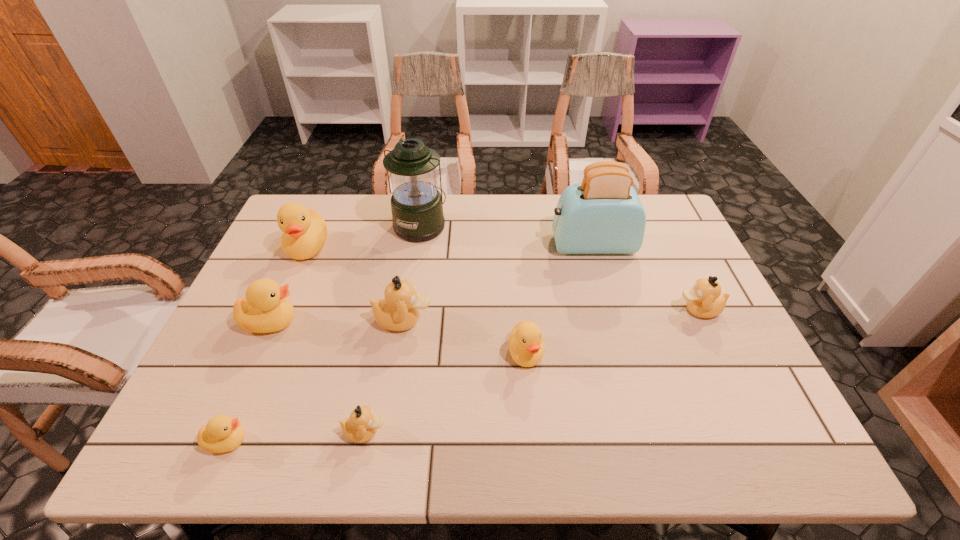
In order to click on lantern in this screenshot , I will do `click(416, 204)`.

I want to click on the eighth object from left to right, so click(602, 215).

The image size is (960, 540). In order to click on toaster in this screenshot , I will do `click(602, 215)`.

Locate an element on the screen. the farthest yellow duckling is located at coordinates (304, 230).

I want to click on the farthest duckling, so click(x=304, y=230).

The image size is (960, 540). Find the location of `the biggest tan duckling`. the biggest tan duckling is located at coordinates (399, 310).

I want to click on the second biggest yellow duckling, so click(x=265, y=309).

Image resolution: width=960 pixels, height=540 pixels. In order to click on the second biggest tan duckling in this screenshot , I will do `click(704, 300)`.

Locate an element on the screen. The width and height of the screenshot is (960, 540). the rightmost duckling is located at coordinates (704, 300).

You are a GUI agent. You are given a task and a screenshot of the screen. Output one action in this format:
    pyautogui.click(x=<x>, y=<y>)
    Task: Click on the seventh object from left to right
    The width and height of the screenshot is (960, 540).
    Given the screenshot: What is the action you would take?
    pyautogui.click(x=526, y=345)